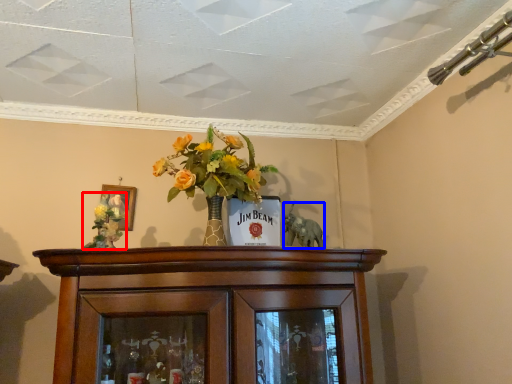
Question: Which point is further to the camera, floral arrangement (highlighted by a red box) or animal (highlighted by a blue box)?

Choices:
 (A) floral arrangement
 (B) animal

Answer: (B)